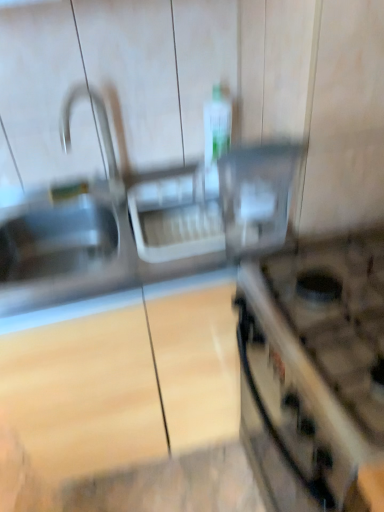
Question: Considering the relative positions of satin nickel faucet at upper left and metallic silver gas stove at right in the image provided, is satin nickel faucet at upper left in front of metallic silver gas stove at right?

Choices:
 (A) yes
 (B) no

Answer: (B)

Question: Is satin nickel faucet at upper left placed right next to metallic silver gas stove at right?

Choices:
 (A) yes
 (B) no

Answer: (B)

Question: Could metallic silver gas stove at right be considered to be inside satin nickel faucet at upper left?

Choices:
 (A) no
 (B) yes

Answer: (A)

Question: Can you confirm if satin nickel faucet at upper left is shorter than metallic silver gas stove at right?

Choices:
 (A) yes
 (B) no

Answer: (A)

Question: From the image's perspective, is satin nickel faucet at upper left over metallic silver gas stove at right?

Choices:
 (A) yes
 (B) no

Answer: (A)

Question: Does satin nickel faucet at upper left have a greater width compared to metallic silver gas stove at right?

Choices:
 (A) no
 (B) yes

Answer: (A)

Question: Is metallic silver gas stove at right outside of satin nickel faucet at upper left?

Choices:
 (A) yes
 (B) no

Answer: (A)

Question: Considering the relative positions of metallic silver gas stove at right and satin nickel faucet at upper left in the image provided, is metallic silver gas stove at right to the left of satin nickel faucet at upper left from the viewer's perspective?

Choices:
 (A) yes
 (B) no

Answer: (B)

Question: Is satin nickel faucet at upper left inside metallic silver gas stove at right?

Choices:
 (A) no
 (B) yes

Answer: (A)

Question: Is metallic silver gas stove at right positioned behind satin nickel faucet at upper left?

Choices:
 (A) no
 (B) yes

Answer: (A)

Question: Does metallic silver gas stove at right have a larger size compared to satin nickel faucet at upper left?

Choices:
 (A) no
 (B) yes

Answer: (B)

Question: Is metallic silver gas stove at right thinner than satin nickel faucet at upper left?

Choices:
 (A) yes
 (B) no

Answer: (B)

Question: Does clear plastic container at center come behind satin nickel faucet at upper left?

Choices:
 (A) yes
 (B) no

Answer: (B)